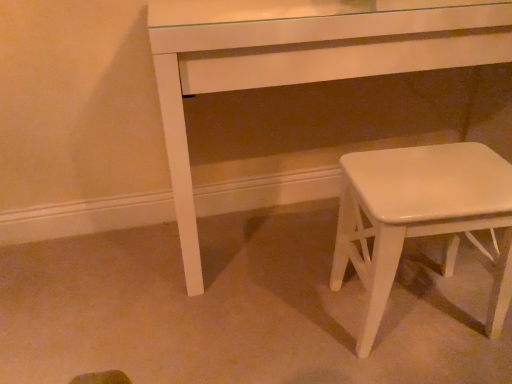
Question: Are white glossy table at center and white glossy stool at lower right beside each other?

Choices:
 (A) no
 (B) yes

Answer: (A)

Question: Can you confirm if white glossy table at center is bigger than white glossy stool at lower right?

Choices:
 (A) yes
 (B) no

Answer: (A)

Question: Is white glossy table at center at the right side of white glossy stool at lower right?

Choices:
 (A) no
 (B) yes

Answer: (A)

Question: From a real-world perspective, is white glossy table at center physically below white glossy stool at lower right?

Choices:
 (A) no
 (B) yes

Answer: (A)

Question: Is white glossy table at center positioned behind white glossy stool at lower right?

Choices:
 (A) yes
 (B) no

Answer: (A)

Question: Considering the relative sizes of white glossy table at center and white glossy stool at lower right in the image provided, is white glossy table at center thinner than white glossy stool at lower right?

Choices:
 (A) no
 (B) yes

Answer: (A)

Question: Does white glossy stool at lower right have a lesser width compared to white glossy table at center?

Choices:
 (A) yes
 (B) no

Answer: (A)

Question: Is white glossy stool at lower right aimed at white glossy table at center?

Choices:
 (A) no
 (B) yes

Answer: (A)

Question: Does white glossy stool at lower right have a greater height compared to white glossy table at center?

Choices:
 (A) yes
 (B) no

Answer: (B)

Question: Is white glossy stool at lower right to the left of white glossy table at center from the viewer's perspective?

Choices:
 (A) no
 (B) yes

Answer: (A)

Question: Is white glossy stool at lower right positioned beyond the bounds of white glossy table at center?

Choices:
 (A) no
 (B) yes

Answer: (B)

Question: Is white glossy stool at lower right directly adjacent to white glossy table at center?

Choices:
 (A) yes
 (B) no

Answer: (B)

Question: Is point (459, 180) positioned closer to the camera than point (212, 59)?

Choices:
 (A) farther
 (B) closer

Answer: (B)